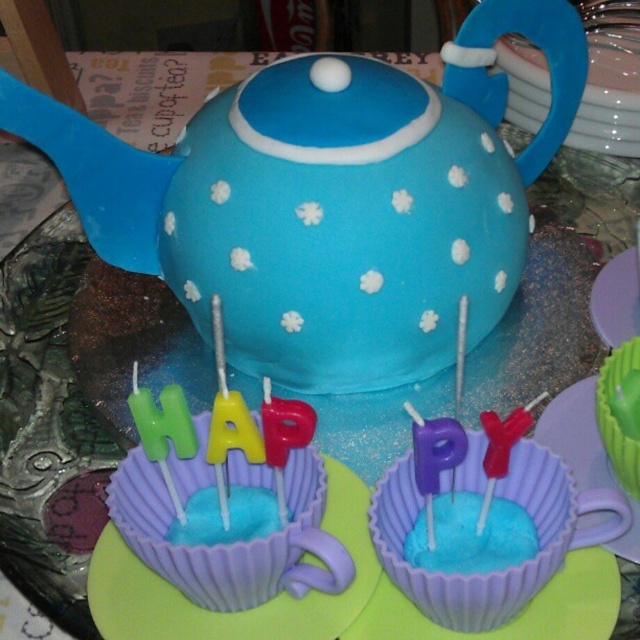
You are a guest at a birthday party and want to take a photo of the cake and the cupcakes. The photographer asks you to identify which object is taller between the matte purple cupcake liner at center and the green paper cupcake at lower right. What do you tell them?

The green paper cupcake at lower right is taller than the matte purple cupcake liner at center.

You are a guest at a birthday party and want to grab a cupcake. The matte purple saucer at center is in your way. Can you move the saucer to access the green paper cupcake at lower right?

The matte purple saucer at center is positioned under the green paper cupcake at lower right, so you cannot move the saucer without also moving the cupcake.

You are a baker trying to place a green paper cupcake at lower right into a matte purple cupcake liner at center. Will the cupcake fit inside the liner?

The matte purple cupcake liner at center is larger in size than the green paper cupcake at lower right, so the cupcake will fit inside the liner.